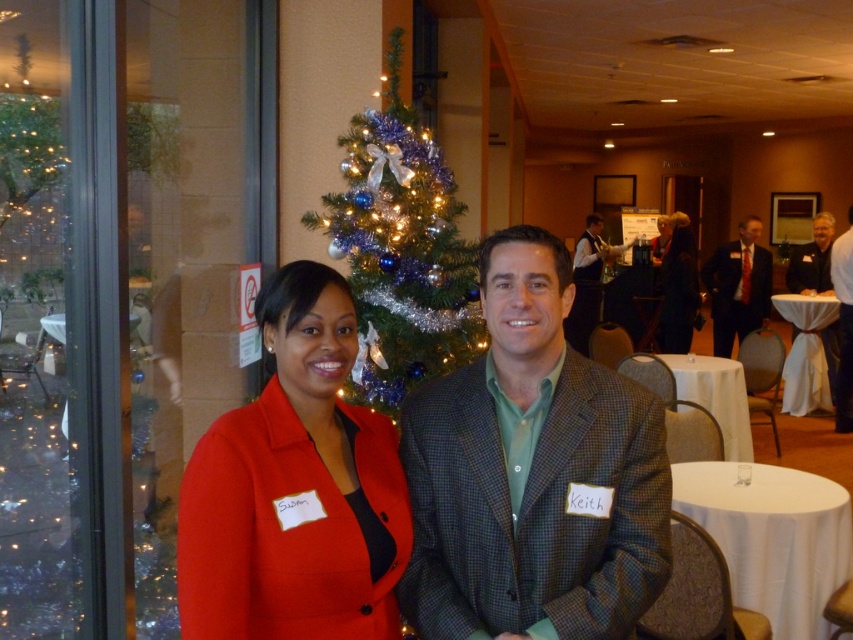
Question: Which object is positioned closest to the white cloth-covered table at right?

Choices:
 (A) matte black suit at right
 (B) matte red blazer at center
 (C) dark gray suit at right

Answer: (A)

Question: Among these objects, which one is nearest to the camera?

Choices:
 (A) green wool blazer at center
 (B) matte black suit at right
 (C) matte red blazer at center

Answer: (C)

Question: In this image, where is white cloth table at lower right located relative to white tablecloth at center?

Choices:
 (A) right
 (B) left

Answer: (B)

Question: Is matte red blazer at center further to the viewer compared to white tablecloth at center?

Choices:
 (A) yes
 (B) no

Answer: (B)

Question: Is dark gray suit at right to the right of light brown leather jacket at right from the viewer's perspective?

Choices:
 (A) yes
 (B) no

Answer: (A)

Question: Which object is the closest to the dark gray suit at right?

Choices:
 (A) shiny blue tinsel at center
 (B) matte red blazer at center
 (C) matte black suit at right
 (D) white cloth table at lower right

Answer: (C)